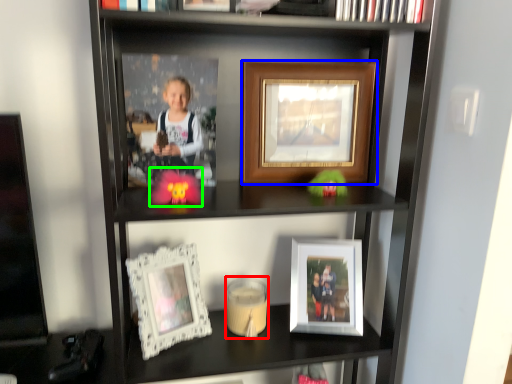
Question: Considering the real-world distances, which object is farthest from candle holder (highlighted by a red box)? picture frame (highlighted by a blue box) or toy (highlighted by a green box)?

Choices:
 (A) picture frame
 (B) toy

Answer: (A)